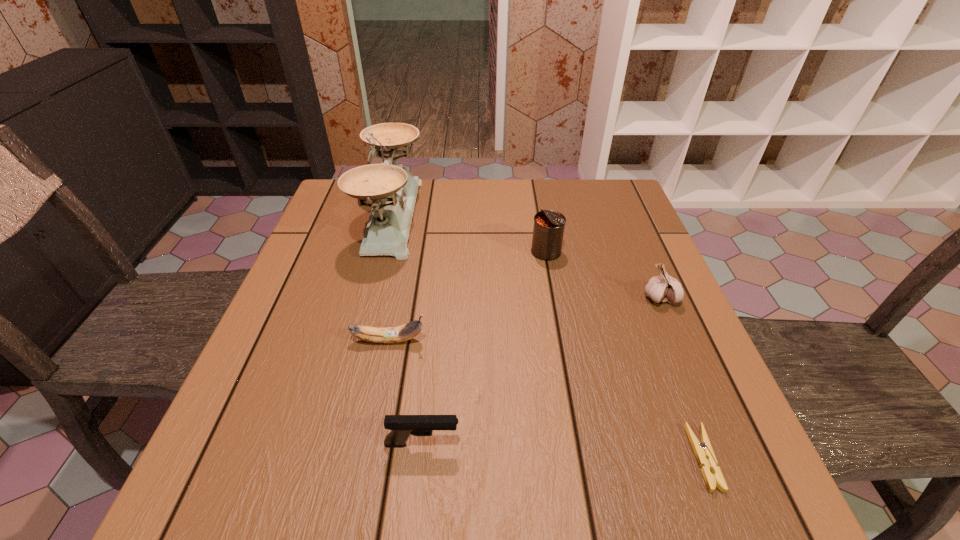
Identify the location of vacant point located between the can and the pistol. This screenshot has width=960, height=540. (484, 348).

Identify the location of empty space between the third farthest object and the fourth object from left to right. The image size is (960, 540). (603, 274).

The image size is (960, 540). Find the location of `free space between the shortest object and the scale`. free space between the shortest object and the scale is located at coordinates (548, 337).

This screenshot has height=540, width=960. Find the location of `free spot between the fourth object from left to right and the fourth nearest object`. free spot between the fourth object from left to right and the fourth nearest object is located at coordinates (603, 274).

Locate an element on the screen. This screenshot has height=540, width=960. vacant point located between the banana and the pistol is located at coordinates (406, 392).

Where is `unoccupied position between the pistol and the fourth nearest object`? This screenshot has width=960, height=540. unoccupied position between the pistol and the fourth nearest object is located at coordinates (541, 371).

Where is `object that is the second closest to the garlic`? The image size is (960, 540). object that is the second closest to the garlic is located at coordinates (703, 451).

Locate which object ranks in proximity to the can. Please provide its 2D coordinates. Your answer should be formatted as a tuple, i.e. [(x, y)], where the tuple contains the x and y coordinates of a point satisfying the conditions above.

[(664, 288)]

You are a GUI agent. You are given a task and a screenshot of the screen. Output one action in this format:
    pyautogui.click(x=<x>, y=<y>)
    Task: Click on the vacant region that satisfies the following two spatial constraints: 1. on the front-facing side of the garlic; 2. on the right side of the scale
    The width and height of the screenshot is (960, 540).
    Given the screenshot: What is the action you would take?
    pyautogui.click(x=371, y=298)

You are a GUI agent. You are given a task and a screenshot of the screen. Output one action in this format:
    pyautogui.click(x=<x>, y=<y>)
    Task: Click on the free location that satisfies the following two spatial constraints: 1. on the front side of the shortest object; 2. on the right side of the can
    
    Given the screenshot: What is the action you would take?
    pyautogui.click(x=583, y=458)